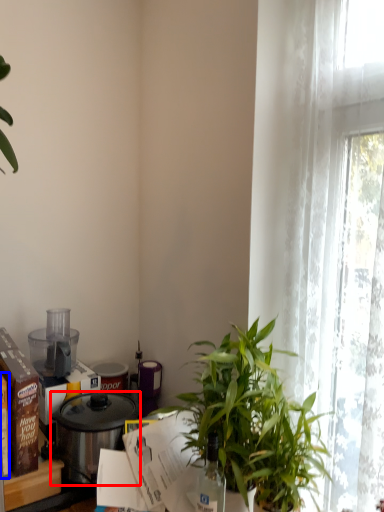
Question: Which object appears closest to the camera in this image, pot/pan (highlighted by a red box) or box (highlighted by a blue box)?

Choices:
 (A) pot/pan
 (B) box

Answer: (B)